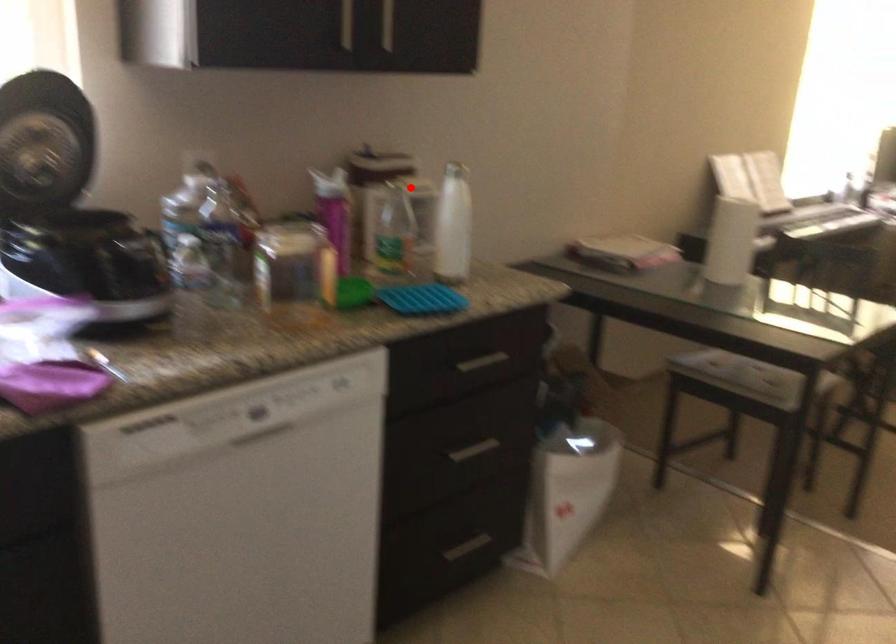
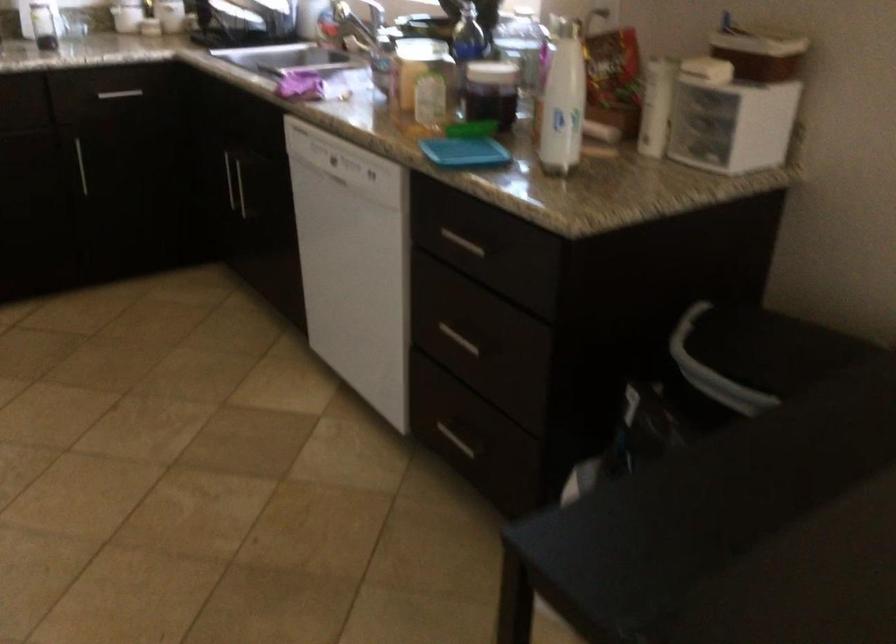
Locate, in the second image, the point that corresponds to the highlighted location in the first image.

(563, 100)